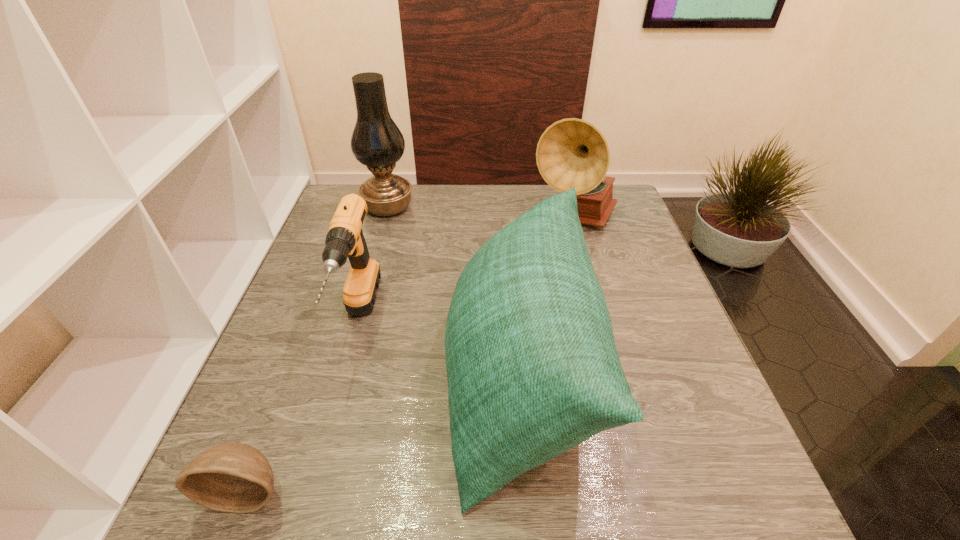
This screenshot has height=540, width=960. I want to click on oil lamp, so click(376, 142).

This screenshot has width=960, height=540. In order to click on phonograph record in this screenshot , I will do `click(572, 152)`.

At what (x,y) coordinates should I click in order to perform the action: click on cushion. Please return your answer as a coordinate pair (x, y). Looking at the image, I should click on (532, 367).

Where is `drill`? This screenshot has width=960, height=540. drill is located at coordinates (345, 239).

You are a GUI agent. You are given a task and a screenshot of the screen. Output one action in this format:
    pyautogui.click(x=<x>, y=<y>)
    Task: Click on the shortest object
    The height and width of the screenshot is (540, 960).
    Given the screenshot: What is the action you would take?
    pyautogui.click(x=233, y=477)

What are the coordinates of `blank space located 0.050m on the right of the oil lamp` in the screenshot? It's located at (430, 207).

Locate an element on the screen. The image size is (960, 540). vacant space situated 0.400m on the horn of the phonograph record is located at coordinates (614, 365).

Find the location of `free space located on the front-facing side of the cushion`. free space located on the front-facing side of the cushion is located at coordinates (369, 377).

The height and width of the screenshot is (540, 960). I want to click on free spot located 0.260m on the front-facing side of the cushion, so click(320, 377).

I want to click on free space located 0.200m on the front-facing side of the cushion, so click(x=349, y=377).